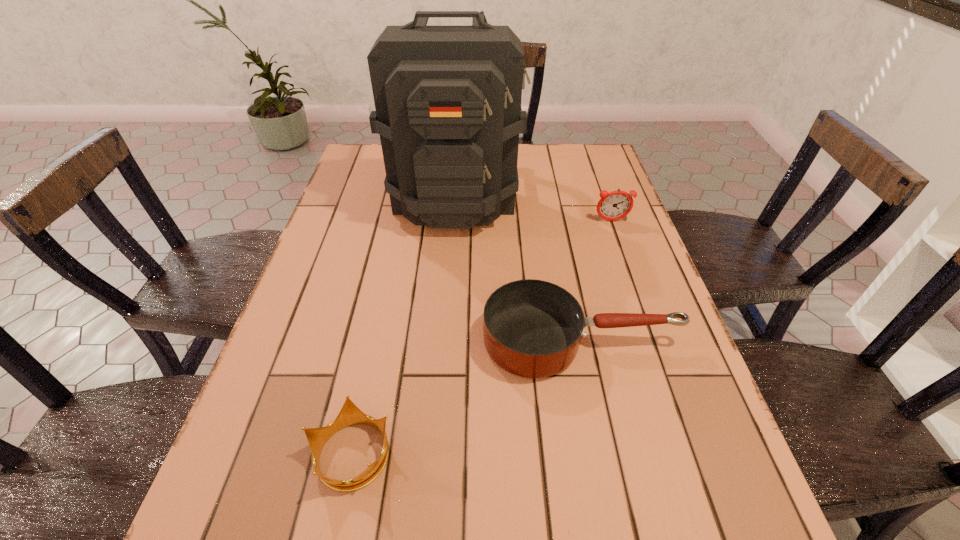
Locate an element on the screen. vacant region that satisfies the following two spatial constraints: 1. on the front-facing side of the alarm clock; 2. on the handle side of the third farthest object is located at coordinates (654, 341).